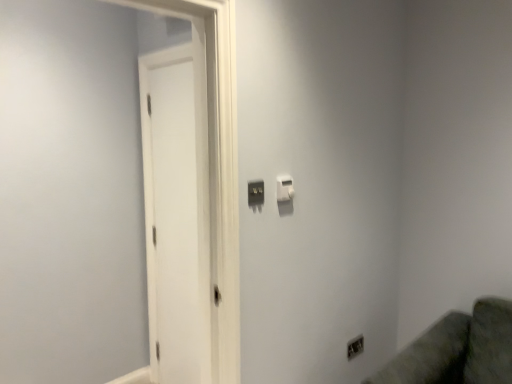
Question: In which direction should I rotate to look at white plastic light switch at upper center, acting as the first light switch starting from the right?

Choices:
 (A) right
 (B) left

Answer: (A)

Question: Considering the relative sizes of matte black switch at center, which is the 1th light switch from left to right, and satin silver outlet at lower right in the image provided, is matte black switch at center, which is the 1th light switch from left to right, bigger than satin silver outlet at lower right?

Choices:
 (A) yes
 (B) no

Answer: (B)

Question: From a real-world perspective, is matte black switch at center, which ranks as the second light switch in back-to-front order, on top of satin silver outlet at lower right?

Choices:
 (A) no
 (B) yes

Answer: (B)

Question: Considering the relative sizes of matte black switch at center, which is the 1th light switch from left to right, and satin silver outlet at lower right in the image provided, is matte black switch at center, which is the 1th light switch from left to right, thinner than satin silver outlet at lower right?

Choices:
 (A) yes
 (B) no

Answer: (A)

Question: Could you tell me if matte black switch at center, which is the first light switch in front-to-back order, is turned towards satin silver outlet at lower right?

Choices:
 (A) yes
 (B) no

Answer: (B)

Question: Considering the relative sizes of matte black switch at center, which ranks as the second light switch in back-to-front order, and satin silver outlet at lower right in the image provided, is matte black switch at center, which ranks as the second light switch in back-to-front order, wider than satin silver outlet at lower right?

Choices:
 (A) no
 (B) yes

Answer: (A)

Question: From the image's perspective, is matte black switch at center, which is the 1th light switch from left to right, below satin silver outlet at lower right?

Choices:
 (A) no
 (B) yes

Answer: (A)

Question: Can you confirm if satin silver outlet at lower right is thinner than white plastic light switch at upper center, acting as the first light switch starting from the right?

Choices:
 (A) yes
 (B) no

Answer: (A)

Question: From a real-world perspective, is satin silver outlet at lower right beneath white plastic light switch at upper center, which appears as the 2th light switch when viewed from the left?

Choices:
 (A) yes
 (B) no

Answer: (A)

Question: Is satin silver outlet at lower right to the left of white plastic light switch at upper center, which is the first light switch in back-to-front order, from the viewer's perspective?

Choices:
 (A) yes
 (B) no

Answer: (B)

Question: From a real-world perspective, is satin silver outlet at lower right positioned over white plastic light switch at upper center, the 2th light switch when ordered from front to back, based on gravity?

Choices:
 (A) yes
 (B) no

Answer: (B)

Question: Can you confirm if satin silver outlet at lower right is wider than white plastic light switch at upper center, which is the first light switch in back-to-front order?

Choices:
 (A) yes
 (B) no

Answer: (B)

Question: Is satin silver outlet at lower right located outside white plastic light switch at upper center, acting as the first light switch starting from the right?

Choices:
 (A) yes
 (B) no

Answer: (A)

Question: Is white matte door at left further to camera compared to satin silver outlet at lower right?

Choices:
 (A) no
 (B) yes

Answer: (A)